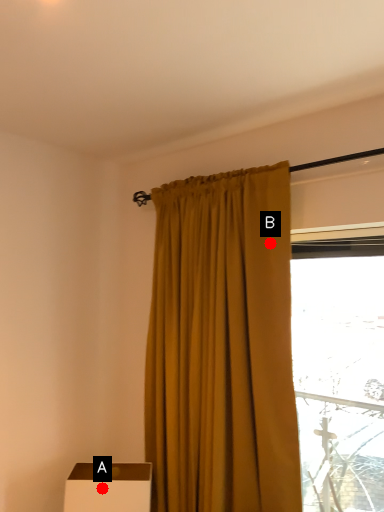
Question: Two points are circled on the image, labeled by A and B beside each circle. Which point appears farthest from the camera in this image?

Choices:
 (A) A is further
 (B) B is further

Answer: (A)